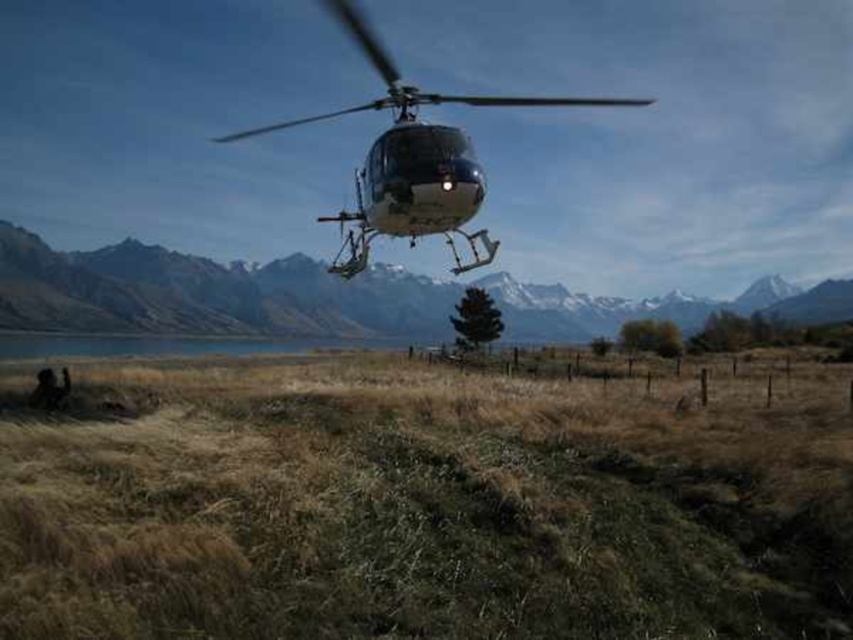
You are a pilot flying a helicopter that requires a minimum of 300 meters of distance between other aircraft for safe navigation. You see the matte gray helicopter at upper center and the metallic silver helicopter at center. Is there enough space between them to maintain safe distance?

The matte gray helicopter at upper center is 258.57 meters from the metallic silver helicopter at center. Since the required safe distance is 300 meters, the current separation is insufficient to maintain safe navigation.

You are a pilot flying a small plane that needs to land in the area shown in the image. The airport runway is located near the matte gray helicopter at upper center. Your plane requires a minimum of 2000 feet of clearance to safely land. Can you safely land your plane based on the distance provided?

The matte gray helicopter at upper center is 2472.63 feet away from the viewer. Since this distance exceeds the required 2000 feet clearance, you can safely land your plane near the matte gray helicopter at upper center.